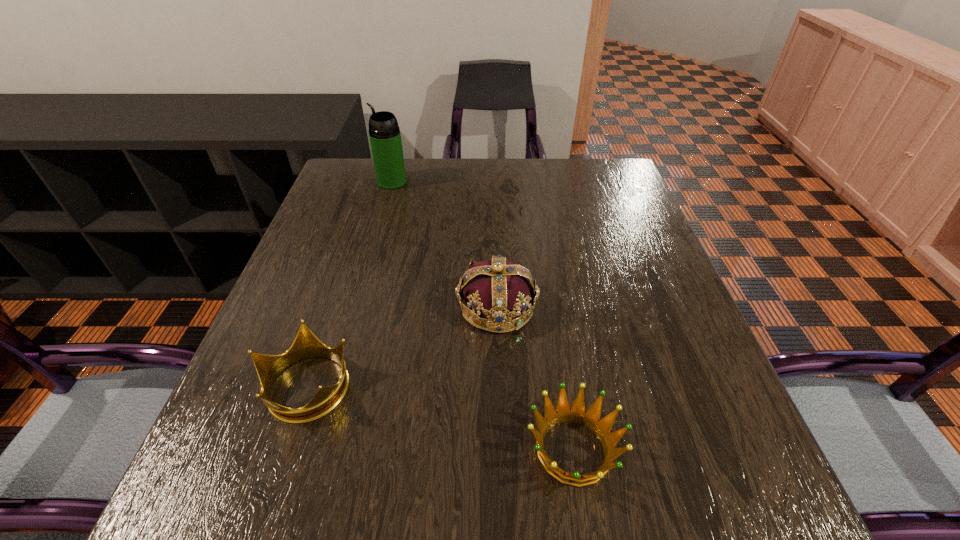
The width and height of the screenshot is (960, 540). I want to click on the farthest object, so click(384, 133).

Locate an element on the screen. This screenshot has width=960, height=540. thermos bottle is located at coordinates (384, 133).

Where is `the tallest crown`? Image resolution: width=960 pixels, height=540 pixels. the tallest crown is located at coordinates (500, 290).

This screenshot has height=540, width=960. In order to click on the farthest crown in this screenshot , I will do `click(500, 290)`.

This screenshot has width=960, height=540. I want to click on the third tallest object, so click(306, 345).

This screenshot has height=540, width=960. In order to click on the second shortest crown in this screenshot , I will do `click(306, 345)`.

Where is `the shortest object`? Image resolution: width=960 pixels, height=540 pixels. the shortest object is located at coordinates (577, 413).

Find the location of a particular element. The width and height of the screenshot is (960, 540). free point located 0.100m from the spout of the farthest object is located at coordinates (344, 182).

Identify the location of vacant space positioned from the spout of the farthest object. The image size is (960, 540). (357, 182).

This screenshot has width=960, height=540. I want to click on vacant space located from the spout of the farthest object, so click(357, 182).